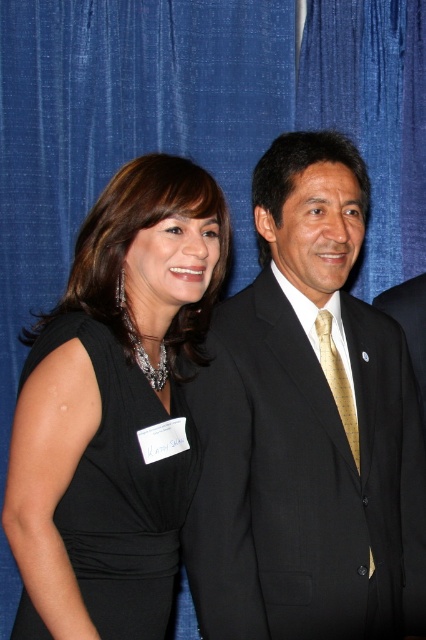
You are a photographer setting up for a group photo. You need to ensure that the black matte dress at left and the gold silk tie at center are at least 18 inches apart for proper lighting. Based on the current positioning, is this requirement met?

The distance between the black matte dress at left and the gold silk tie at center is 17.56 inches, which is less than the required 18 inches. Therefore, the requirement is not met.

You are a photographer adjusting the lighting for a photoshoot. The subjects are wearing the black matte dress at left and the matte black suit at center. Since black absorbs light, you need to ensure proper exposure. Which subject should you focus on first to adjust the lighting, the one closer to the camera or the one further away?

The black matte dress at left is closer to the viewer, so you should focus on adjusting the lighting for the black matte dress at left first since it is nearer and may require more precise exposure adjustments.

You are a photographer setting up for a group photo. You notice the black matte dress at left and the matte black suit at center in the frame. Which clothing item takes up more space in the photo?

The black matte dress at left is larger in size than the matte black suit at center, so it takes up more space in the photo.